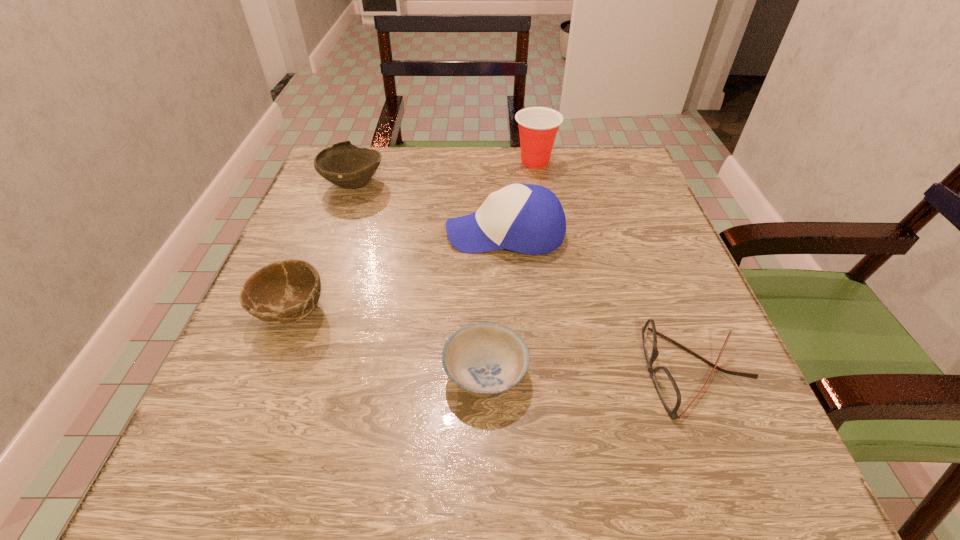
Locate which bowl is the second closest to the cup. Please provide its 2D coordinates. Your answer should be formatted as a tuple, i.e. [(x, y)], where the tuple contains the x and y coordinates of a point satisfying the conditions above.

[(486, 360)]

Locate an element on the screen. Image resolution: width=960 pixels, height=540 pixels. free location that satisfies the following two spatial constraints: 1. on the front-facing side of the baseball cap; 2. on the front side of the second nearest bowl is located at coordinates (510, 312).

I want to click on vacant space that satisfies the following two spatial constraints: 1. on the front side of the second nearest bowl; 2. on the left side of the rightmost bowl, so (267, 375).